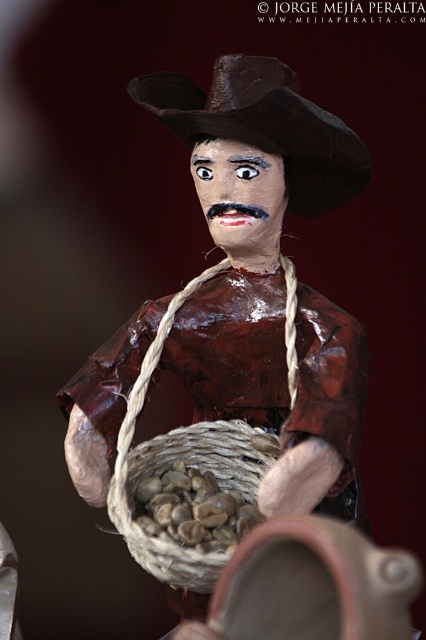
Is brown paper cowboy hat at center in front of woven brown basket at center?

That is False.

Does brown paper cowboy hat at center appear over woven brown basket at center?

Indeed, brown paper cowboy hat at center is positioned over woven brown basket at center.

Between point (339, 160) and point (187, 432), which one is positioned in front?

Point (339, 160) is in front.

Where is `brown paper cowboy hat at center`? The width and height of the screenshot is (426, 640). brown paper cowboy hat at center is located at coordinates (264, 125).

Is brown paper cowboy hat at center shorter than brown matte nuts at center?

In fact, brown paper cowboy hat at center may be taller than brown matte nuts at center.

The height and width of the screenshot is (640, 426). Find the location of `brown paper cowboy hat at center`. brown paper cowboy hat at center is located at coordinates (264, 125).

Between woven brown basket at center and brown matte nuts at center, which one appears on the right side from the viewer's perspective?

brown matte nuts at center is more to the right.

Which of these two, woven brown basket at center or brown matte nuts at center, stands shorter?

brown matte nuts at center

Is point (149, 557) less distant than point (207, 536)?

Yes, it is.

I want to click on woven brown basket at center, so click(x=195, y=467).